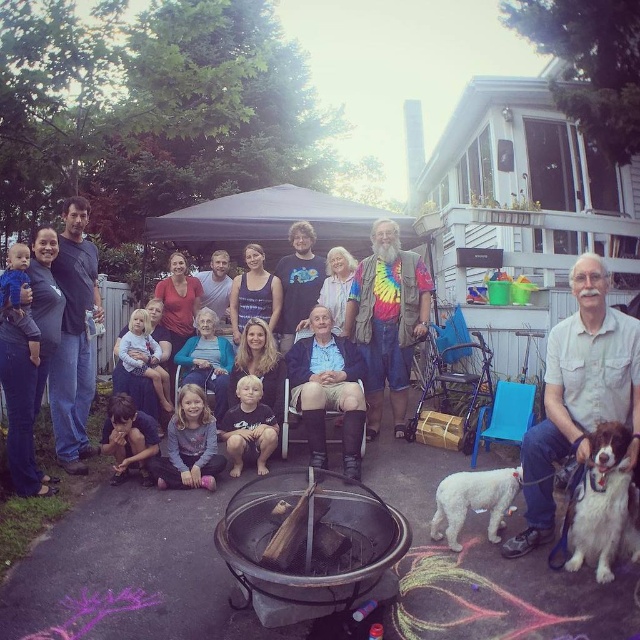
You are a photographer at this gathering and want to take a photo that includes both the white fur dog at lower right and the dark blue shirt at lower left. Since you want to ensure both are clearly visible, which object should you focus on first to account for their sizes?

The white fur dog at lower right is smaller than the dark blue shirt at lower left. To ensure both are clearly visible, you should focus on the white fur dog at lower right first because it is smaller and might require more precise focusing to capture details.

You are a photographer standing at the center of the scene. You want to take a photo that includes both the white fluffy dog at lower right and the dark blue shirt at lower left. What is the minimum focal length lens you should use to capture both subjects in the frame without moving your position?

The minimum focal length lens required to capture both the white fluffy dog at lower right and the dark blue shirt at lower left in the same frame would depend on the camera sensor size and the desired field of view. However, since the distance between them is 2.70 meters, a wide angle lens around 35mm might be suitable for most standard cameras to ensure both subjects are included without cropping.

You are at the gathering and want to pet the white fluffy dog at lower right and the dark blue shirt at lower left. Which one can you reach without moving from your current spot?

The white fluffy dog at lower right is closer to the viewer, so you can reach it without moving. The dark blue shirt at lower left is farther away and may require moving closer to reach.